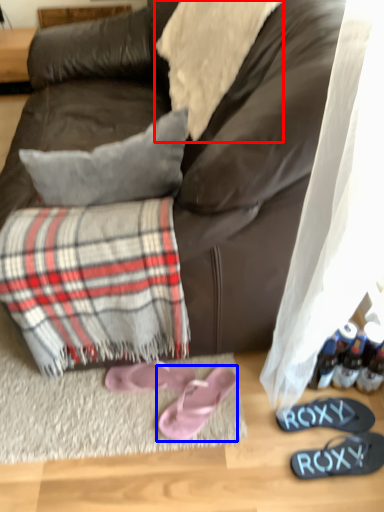
Question: Which of the following is the farthest to the observer, cloth (highlighted by a red box) or footwear (highlighted by a blue box)?

Choices:
 (A) cloth
 (B) footwear

Answer: (B)